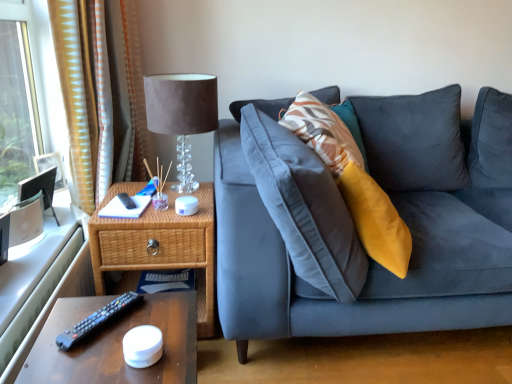
Locate an element on the screen. The width and height of the screenshot is (512, 384). free point above brown wooden table at lower left (from a real-world perspective) is located at coordinates (112, 328).